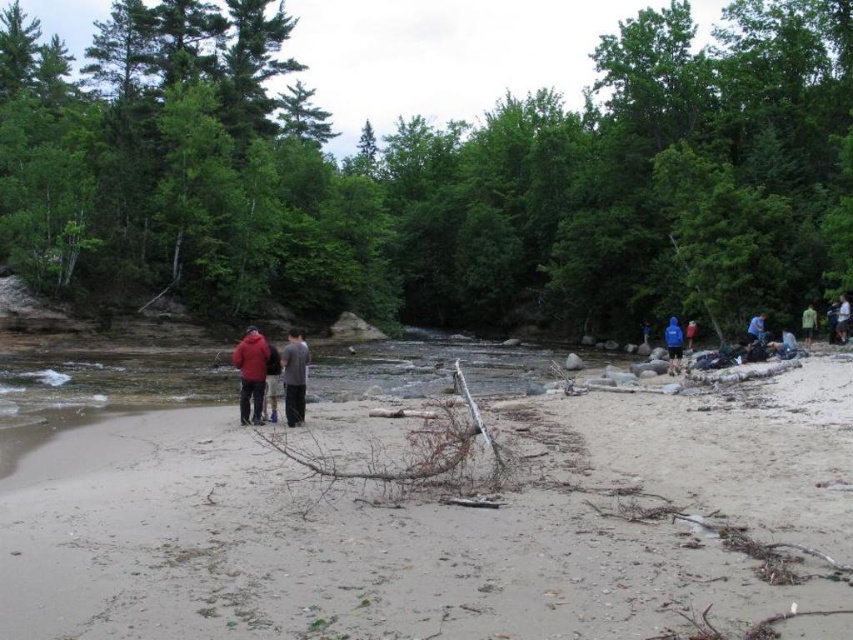
Is matte gray hoodie at center to the right of dark gray cotton shirt at center from the viewer's perspective?

Incorrect, matte gray hoodie at center is not on the right side of dark gray cotton shirt at center.

Which is in front, point (247, 349) or point (292, 332)?

Point (247, 349) is more forward.

At what (x,y) coordinates should I click in order to perform the action: click on matte gray hoodie at center. Please return your answer as a coordinate pair (x, y). Looking at the image, I should click on (294, 376).

Who is more forward, [305,342] or [761,326]?

Point [305,342]

Can you confirm if matte gray hoodie at center is smaller than blue fabric shirt at right?

No, matte gray hoodie at center is not smaller than blue fabric shirt at right.

What do you see at coordinates (294, 376) in the screenshot? I see `matte gray hoodie at center` at bounding box center [294, 376].

The width and height of the screenshot is (853, 640). I want to click on matte gray hoodie at center, so click(x=294, y=376).

From the picture: Does blue fabric jacket at right appear on the right side of blue fabric shirt at right?

Incorrect, blue fabric jacket at right is not on the right side of blue fabric shirt at right.

Image resolution: width=853 pixels, height=640 pixels. What do you see at coordinates (672, 344) in the screenshot?
I see `blue fabric jacket at right` at bounding box center [672, 344].

I want to click on blue fabric jacket at right, so click(x=672, y=344).